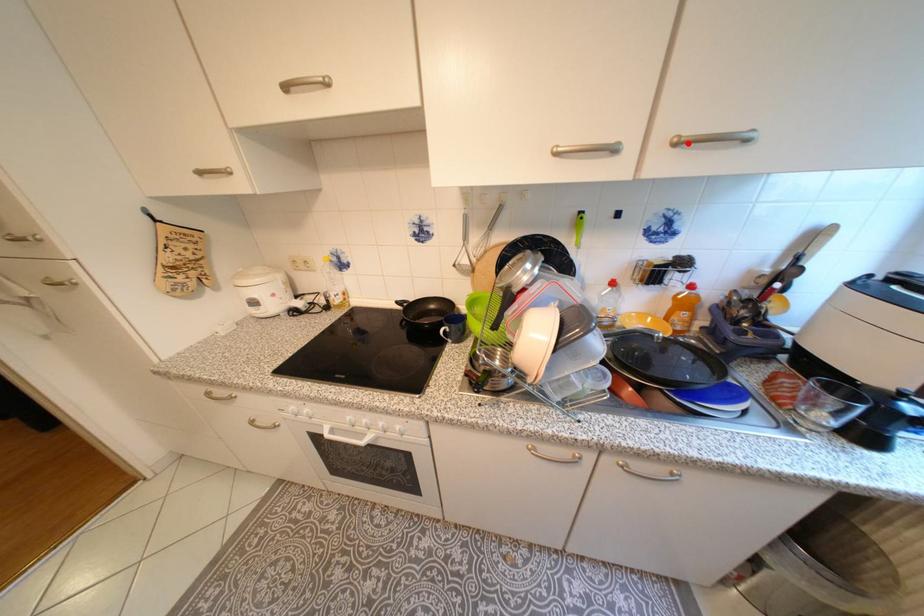
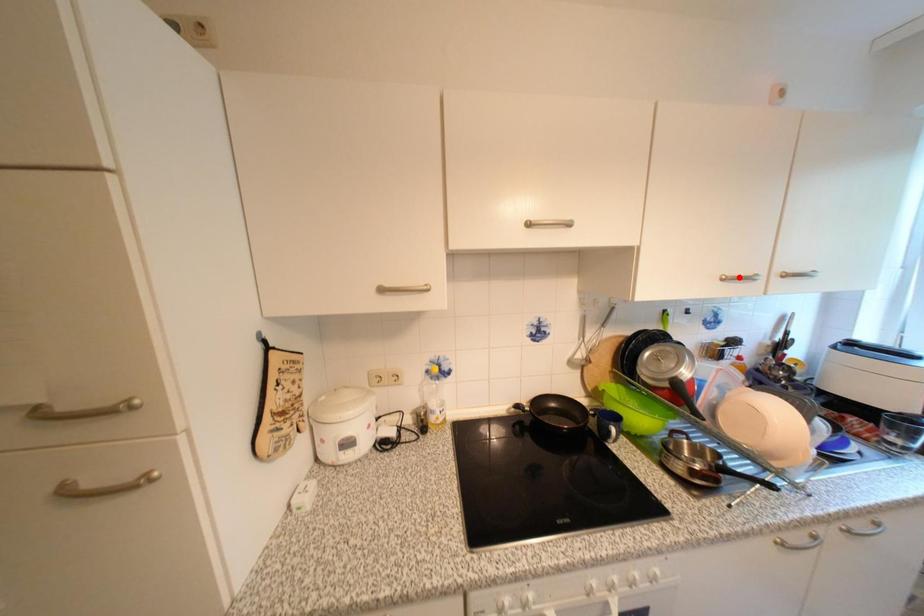
I am providing you with two images of the same scene from different viewpoints. A red point is marked on the first image and another point is marked on the second image. Is the marked point in image1 the same physical position as the marked point in image2?

No